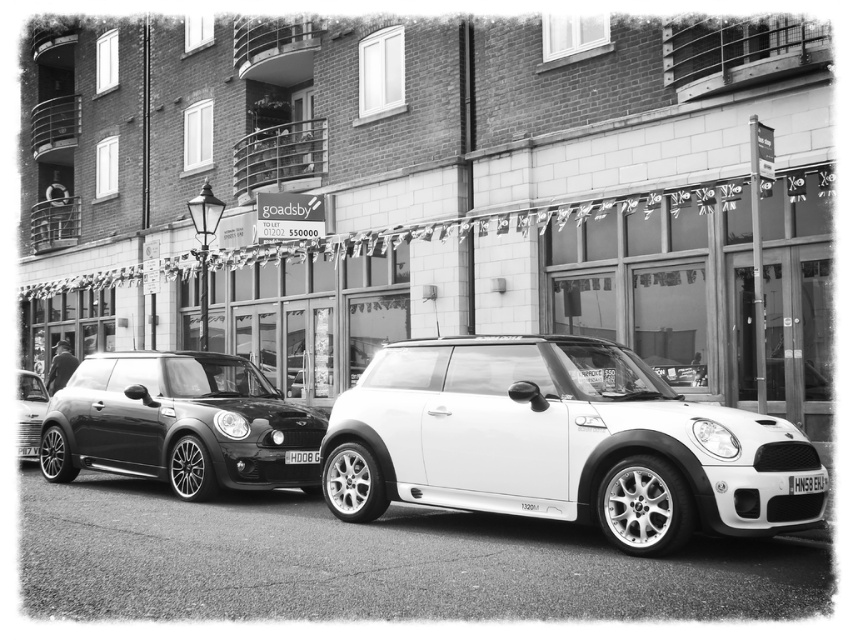
In the scene shown: Between shiny silver car at left and white plastic license plate at center, which one is positioned lower?

Positioned lower is shiny silver car at left.

Does shiny silver car at left have a smaller size compared to white plastic license plate at center?

No.

Is point (28, 458) positioned before point (820, 481)?

No, it is not.

At what (x,y) coordinates should I click in order to perform the action: click on shiny silver car at left. Please return your answer as a coordinate pair (x, y). The image size is (853, 640). Looking at the image, I should click on (28, 412).

Between white metallic car at center and black plastic license plate at center, which one is positioned lower?

black plastic license plate at center

Is white metallic car at center bigger than black plastic license plate at center?

Yes, white metallic car at center is bigger than black plastic license plate at center.

I want to click on white metallic car at center, so click(560, 444).

Find the location of `white metallic car at center`. white metallic car at center is located at coordinates (560, 444).

Is shiny silver car at left positioned in front of black plastic license plate at center?

No, shiny silver car at left is further to the viewer.

Is shiny silver car at left behind black plastic license plate at center?

That is True.

Between point (24, 376) and point (312, 452), which one is positioned behind?

Positioned behind is point (24, 376).

The image size is (853, 640). I want to click on shiny silver car at left, so click(28, 412).